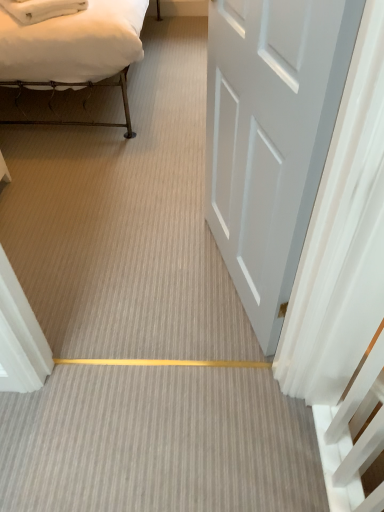
Question: Does white glossy door at center appear on the right side of white cotton bed at upper left?

Choices:
 (A) yes
 (B) no

Answer: (A)

Question: From a real-world perspective, is white glossy door at center on top of white cotton bed at upper left?

Choices:
 (A) no
 (B) yes

Answer: (B)

Question: Can you confirm if white glossy door at center is thinner than white cotton bed at upper left?

Choices:
 (A) yes
 (B) no

Answer: (A)

Question: From the image's perspective, is white glossy door at center above white cotton bed at upper left?

Choices:
 (A) no
 (B) yes

Answer: (A)

Question: From a real-world perspective, is white glossy door at center physically below white cotton bed at upper left?

Choices:
 (A) yes
 (B) no

Answer: (B)

Question: Is white glossy door at center looking in the opposite direction of white cotton bed at upper left?

Choices:
 (A) no
 (B) yes

Answer: (A)

Question: From a real-world perspective, is white cotton bed at upper left on white glossy door at center?

Choices:
 (A) yes
 (B) no

Answer: (B)

Question: Is white cotton bed at upper left turned away from white glossy door at center?

Choices:
 (A) no
 (B) yes

Answer: (A)

Question: Can you confirm if white cotton bed at upper left is thinner than white glossy door at center?

Choices:
 (A) yes
 (B) no

Answer: (B)

Question: Is white cotton bed at upper left further to camera compared to white glossy door at center?

Choices:
 (A) no
 (B) yes

Answer: (B)

Question: Is white glossy door at center located within white cotton bed at upper left?

Choices:
 (A) no
 (B) yes

Answer: (A)

Question: Does white cotton bed at upper left have a smaller size compared to white glossy door at center?

Choices:
 (A) no
 (B) yes

Answer: (A)

Question: Is white cotton bed at upper left inside the boundaries of white glossy door at center, or outside?

Choices:
 (A) inside
 (B) outside

Answer: (B)